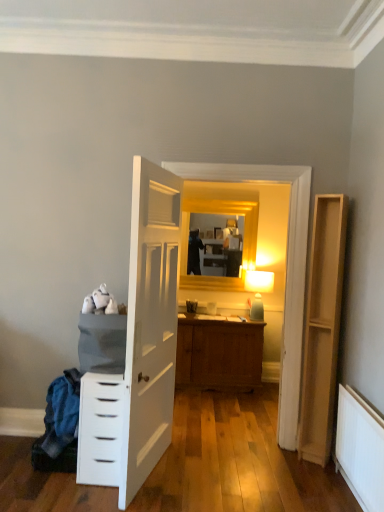
Where is `vacant region to the left of light brown wood file cabinet at right`? vacant region to the left of light brown wood file cabinet at right is located at coordinates (289, 461).